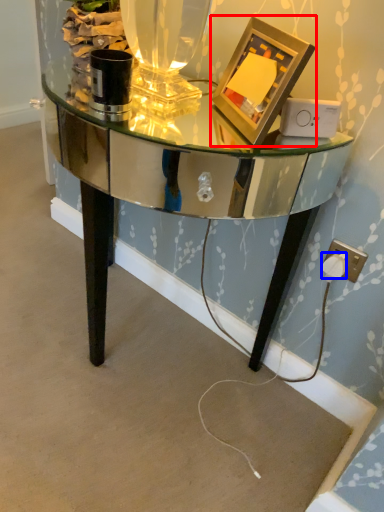
Question: Which point is further to the camera, picture frame (highlighted by a red box) or plug (highlighted by a blue box)?

Choices:
 (A) picture frame
 (B) plug

Answer: (B)